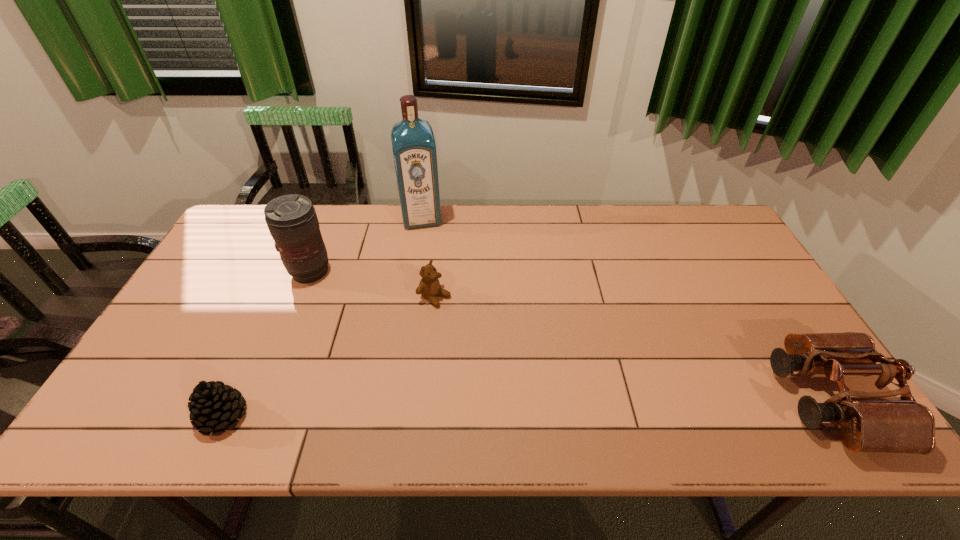
This screenshot has width=960, height=540. In order to click on pinecone in this screenshot , I will do `click(214, 406)`.

This screenshot has height=540, width=960. Find the location of `the third shortest object`. the third shortest object is located at coordinates (870, 421).

The image size is (960, 540). What are the coordinates of `the rightmost object` in the screenshot? It's located at (870, 421).

Image resolution: width=960 pixels, height=540 pixels. In order to click on teddy bear in this screenshot , I will do `click(429, 287)`.

The height and width of the screenshot is (540, 960). Identify the location of the farthest object. (414, 149).

Find the location of a particular element. Image resolution: width=960 pixels, height=540 pixels. the tallest object is located at coordinates (414, 149).

This screenshot has height=540, width=960. In order to click on telephoto lens in this screenshot , I will do `click(292, 221)`.

Locate an element on the screen. The image size is (960, 540). free location located 0.210m through the eyepieces of the rightmost object is located at coordinates (691, 401).

Locate an element on the screen. The height and width of the screenshot is (540, 960). blank space located through the eyepieces of the rightmost object is located at coordinates (644, 401).

Find the location of a particular element. vacant region located through the eyepieces of the rightmost object is located at coordinates (618, 401).